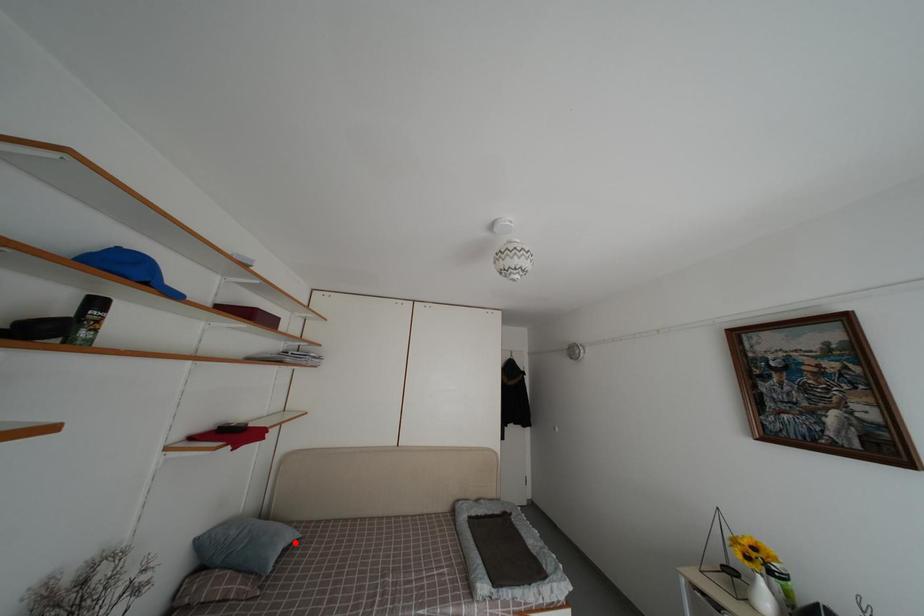
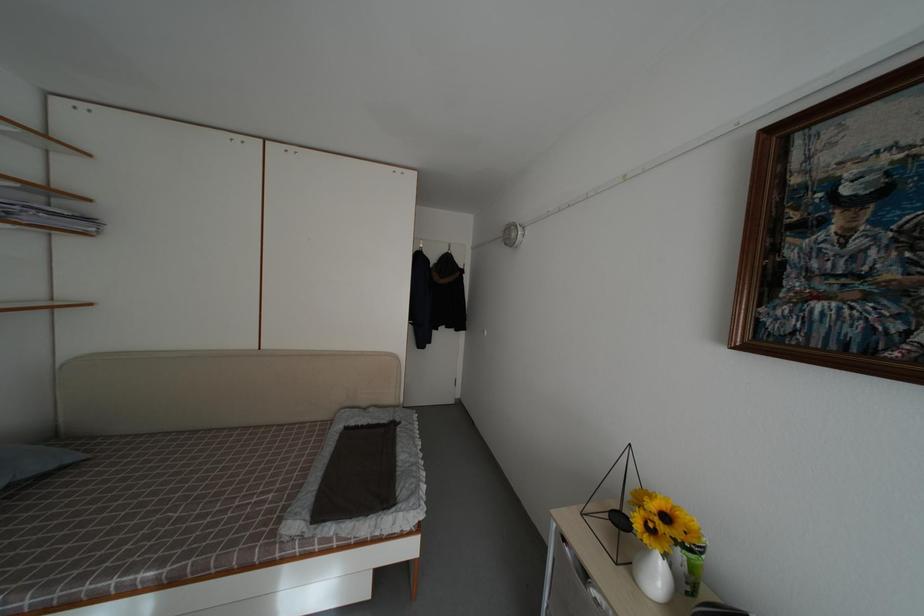
In the second image, find the point that corresponds to the highlighted location in the first image.

(50, 469)